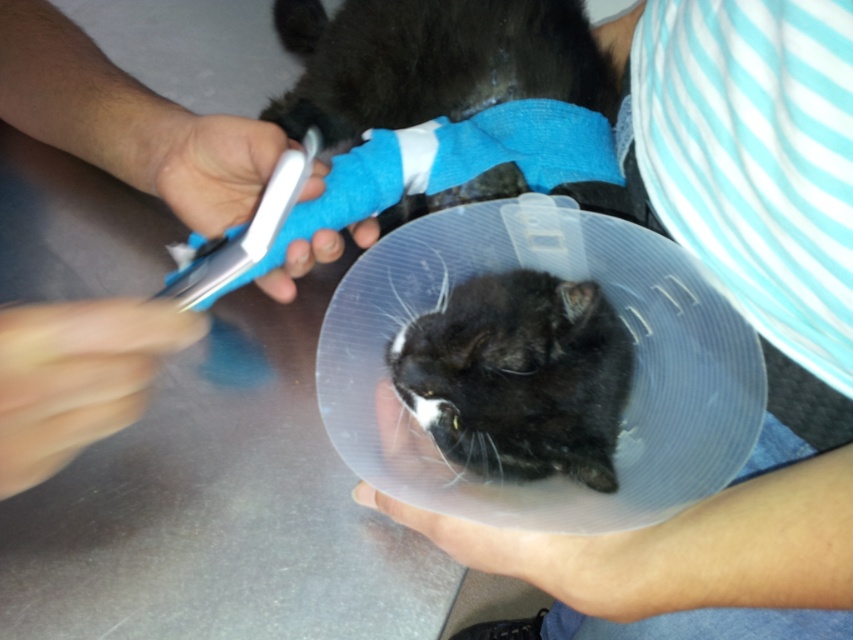
You are a veterinarian examining a cat with an Elizabethan collar. You notice a smooth blue bandage at upper center and a black matte cone at center. Which object is nearer to your eyes?

The smooth blue bandage at upper center is closer to the viewer than the black matte cone at center.